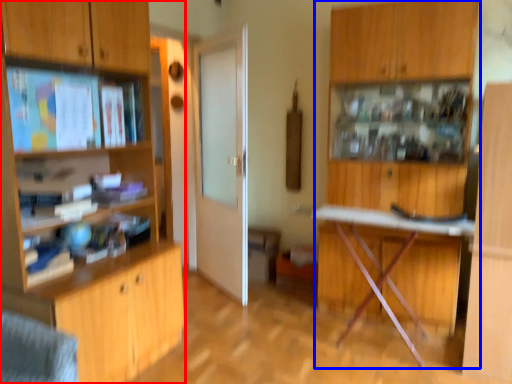
Question: Among these objects, which one is farthest to the camera, cabinetry (highlighted by a red box) or dresser (highlighted by a blue box)?

Choices:
 (A) cabinetry
 (B) dresser

Answer: (B)